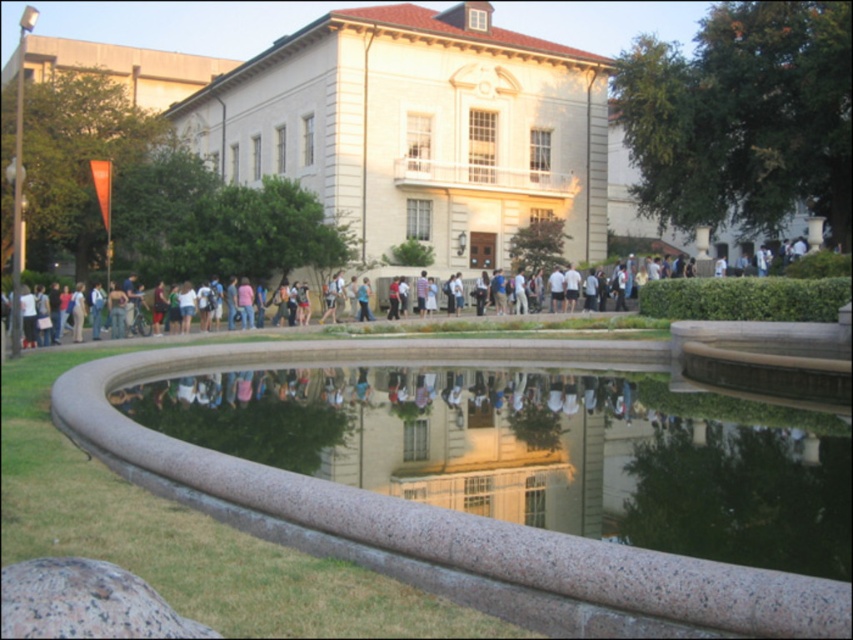
You are standing at the edge of the reflecting pool and want to take a photo of both the white stone building at center and the granite fountain at lower center. Which object will appear larger in the photo?

The white stone building at center will appear larger in the photo because it is taller than the granite fountain at lower center.

You are a photographer planning to capture the white stone building at center and the granite fountain at lower center in a single frame. Given that your camera can only focus on one object at a time, which object should you prioritize focusing on to ensure it appears sharp, considering their sizes?

The white stone building at center is bigger than the granite fountain at lower center, so you should prioritize focusing on the white stone building at center to ensure it appears sharp since larger objects require more precise focus to maintain clarity.

You are planning to install a new pathway between the white stone building at center and the granite fountain at lower center. Based on their widths, which object should you consider for the pathway design to ensure there is enough space?

The white stone building at center is wider than the granite fountain at lower center, so the pathway should be designed closer to the granite fountain at lower center to accommodate the space difference.